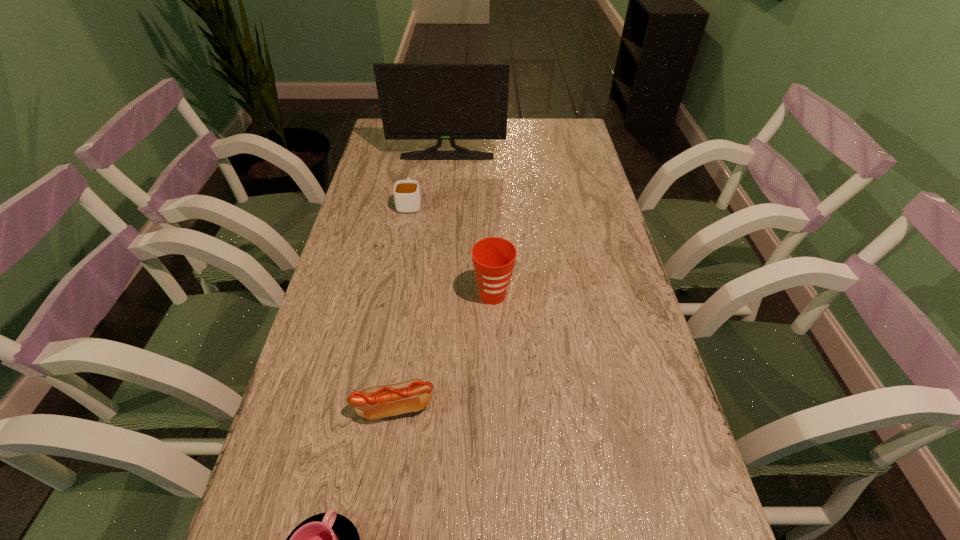
Where is `monitor`? monitor is located at coordinates (418, 101).

The image size is (960, 540). Identify the location of the farthest object. (418, 101).

Find the location of `the third farthest object`. the third farthest object is located at coordinates (494, 258).

In order to click on the tallest cup in this screenshot , I will do `click(494, 258)`.

Where is `the farthest cup`? Image resolution: width=960 pixels, height=540 pixels. the farthest cup is located at coordinates (407, 198).

Where is `the second nearest object`? The height and width of the screenshot is (540, 960). the second nearest object is located at coordinates (376, 402).

This screenshot has width=960, height=540. In order to click on free space located on the front-facing side of the tallest object in this screenshot , I will do `click(439, 239)`.

Locate an element on the screen. free space located 0.120m on the left of the second tallest object is located at coordinates (421, 295).

The width and height of the screenshot is (960, 540). I want to click on vacant area located on the side with the handle of the fourth nearest object, so click(420, 150).

I want to click on vacant region located 0.340m on the side with the handle of the fourth nearest object, so click(x=421, y=137).